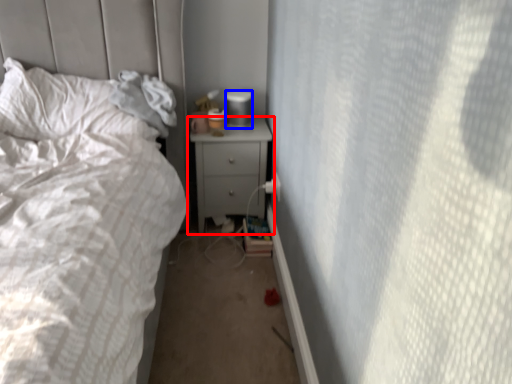
Question: Which object is closer to the camera taking this photo, nightstand (highlighted by a red box) or gray (highlighted by a blue box)?

Choices:
 (A) nightstand
 (B) gray

Answer: (A)